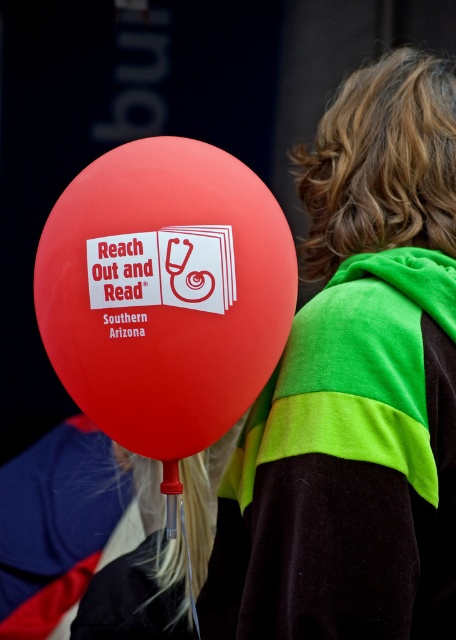
How distant is matte red balloon at left from matte red balloon at center?

matte red balloon at left and matte red balloon at center are 40.68 centimeters apart from each other.

Is the position of matte red balloon at left less distant than that of matte red balloon at center?

No, it is behind matte red balloon at center.

The width and height of the screenshot is (456, 640). I want to click on matte red balloon at left, so click(x=357, y=388).